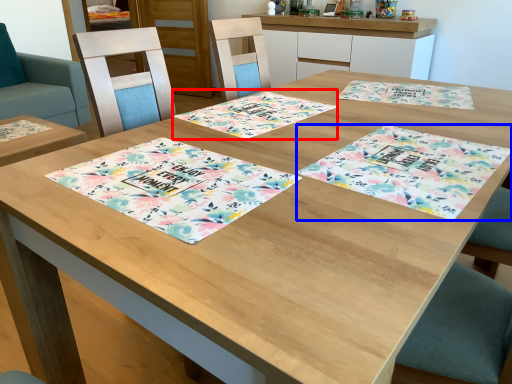
Question: Which of the following is the farthest to the observer, place mat (highlighted by a red box) or place mat (highlighted by a blue box)?

Choices:
 (A) place mat
 (B) place mat

Answer: (A)